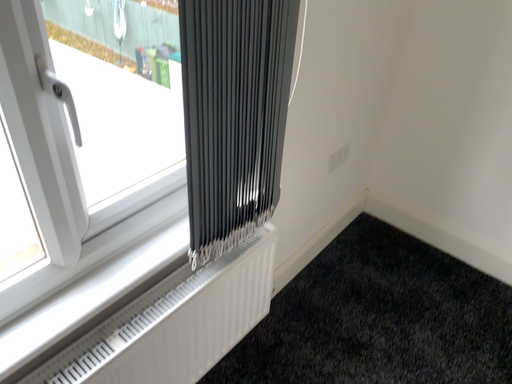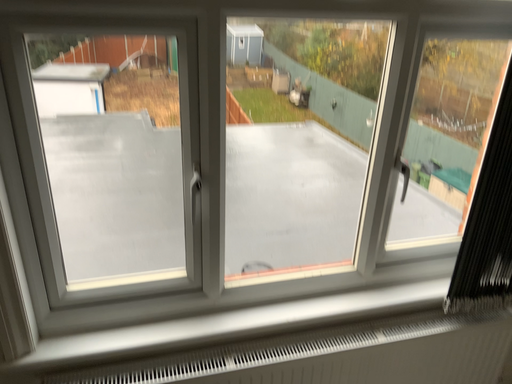
Question: Which way did the camera rotate in the video?

Choices:
 (A) rotated right
 (B) rotated left

Answer: (B)